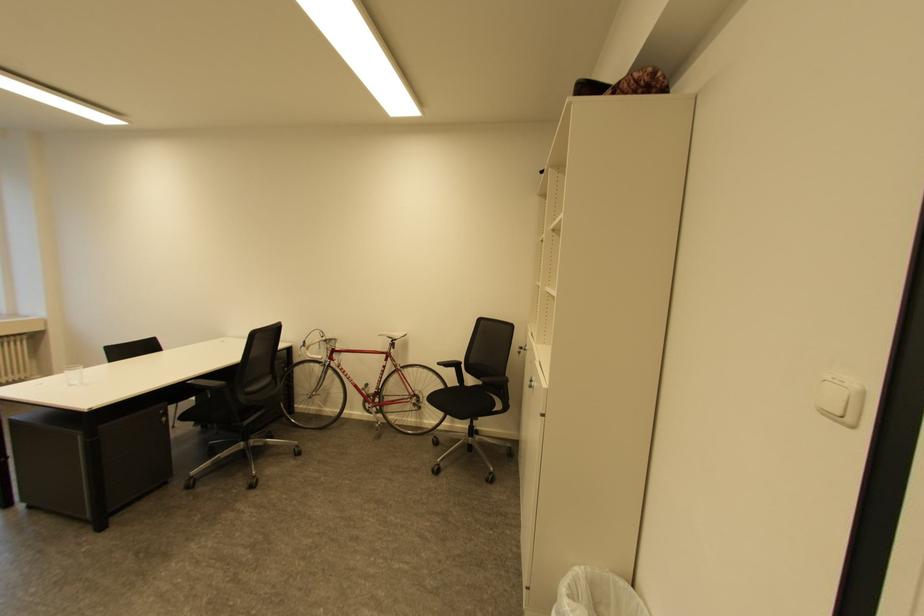
Locate an element on the screen. The width and height of the screenshot is (924, 616). white bicycle saddle is located at coordinates (393, 336).